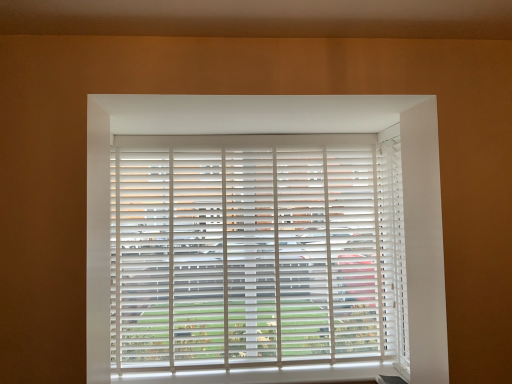
The image size is (512, 384). In order to click on white matte blinds at center in this screenshot , I will do `click(255, 250)`.

Describe the element at coordinates (255, 250) in the screenshot. I see `white matte blinds at center` at that location.

Measure the distance between white matte blinds at right and camera.

white matte blinds at right and camera are 8.02 feet apart.

This screenshot has width=512, height=384. Find the location of `white matte blinds at right`. white matte blinds at right is located at coordinates 392,247.

What is the approximate width of white matte blinds at right?

white matte blinds at right is 2.61 inches wide.

Image resolution: width=512 pixels, height=384 pixels. What do you see at coordinates (392, 247) in the screenshot?
I see `white matte blinds at right` at bounding box center [392, 247].

Locate an element on the screen. The height and width of the screenshot is (384, 512). white matte blinds at center is located at coordinates (255, 250).

Between white matte blinds at center and white matte blinds at right, which one appears on the left side from the viewer's perspective?

From the viewer's perspective, white matte blinds at center appears more on the left side.

Which is in front, white matte blinds at center or white matte blinds at right?

white matte blinds at right is more forward.

Which point is more distant from viewer, (234,290) or (398,165)?

The point (398,165) is more distant.

From the image's perspective, is white matte blinds at center positioned above or below white matte blinds at right?

Clearly, from the image's perspective, white matte blinds at center is below white matte blinds at right.

From a real-world perspective, which object rests below the other?

white matte blinds at right.

In terms of width, does white matte blinds at center look wider or thinner when compared to white matte blinds at right?

Considering their sizes, white matte blinds at center looks broader than white matte blinds at right.

Who is taller, white matte blinds at center or white matte blinds at right?

Standing taller between the two is white matte blinds at right.

Which of these two, white matte blinds at center or white matte blinds at right, is smaller?

Smaller between the two is white matte blinds at right.

Choose the correct answer: Is white matte blinds at center inside white matte blinds at right or outside it?

white matte blinds at center is not enclosed by white matte blinds at right.

Is white matte blinds at center far away from white matte blinds at right?

Actually, white matte blinds at center and white matte blinds at right are a little close together.

Is white matte blinds at center turned away from white matte blinds at right?

No, white matte blinds at center is not facing the opposite direction of white matte blinds at right.

How distant is white matte blinds at center from white matte blinds at right?

23.90 inches.

The image size is (512, 384). In order to click on window blind below the white matte blinds at right (from the image's perspective) in this screenshot , I will do `click(255, 250)`.

Is white matte blinds at right at the right side of white matte blinds at center?

Indeed, white matte blinds at right is positioned on the right side of white matte blinds at center.

Is the position of white matte blinds at right more distant than that of white matte blinds at center?

No, white matte blinds at right is closer to the viewer.

Is point (402, 327) positioned in front of point (373, 356)?

Yes, it is.

From the image's perspective, which is below, white matte blinds at right or white matte blinds at center?

white matte blinds at center, from the image's perspective.

From a real-world perspective, relative to white matte blinds at center, is white matte blinds at right vertically above or below?

From a real-world perspective, white matte blinds at right is physically below white matte blinds at center.

Considering the relative sizes of white matte blinds at right and white matte blinds at center in the image provided, is white matte blinds at right wider than white matte blinds at center?

No.

In terms of height, does white matte blinds at right look taller or shorter compared to white matte blinds at center?

In the image, white matte blinds at right appears to be taller than white matte blinds at center.

Who is smaller, white matte blinds at right or white matte blinds at center?

white matte blinds at right.

Is white matte blinds at right outside of white matte blinds at center?

Yes.

Is there a large distance between white matte blinds at right and white matte blinds at center?

white matte blinds at right is actually quite close to white matte blinds at center.

Does white matte blinds at right turn towards white matte blinds at center?

Yes, white matte blinds at right is turned towards white matte blinds at center.

Where is `window blind below the white matte blinds at right (from the image's perspective)`? The height and width of the screenshot is (384, 512). window blind below the white matte blinds at right (from the image's perspective) is located at coordinates (255, 250).

Image resolution: width=512 pixels, height=384 pixels. In order to click on curtain that appears in front of the white matte blinds at center in this screenshot , I will do `click(392, 247)`.

Where is `curtain on the right of the white matte blinds at center`? This screenshot has width=512, height=384. curtain on the right of the white matte blinds at center is located at coordinates (392, 247).